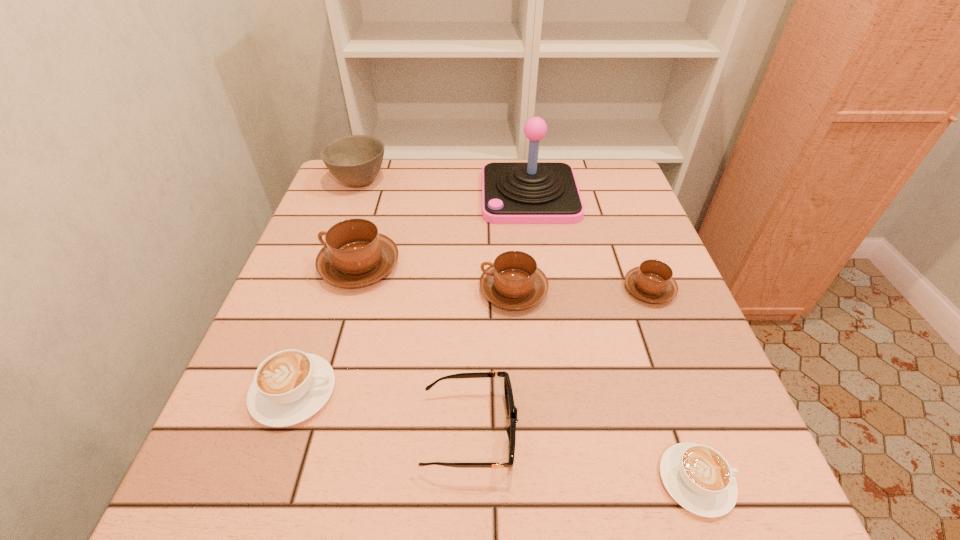
Locate an element on the screen. This screenshot has height=540, width=960. free space at the near left corner of the desktop is located at coordinates (208, 508).

The width and height of the screenshot is (960, 540). I want to click on free space that is in between the shortest cappuccino and the rightmost brown cappuccino, so click(x=673, y=385).

The image size is (960, 540). I want to click on free space between the shortest cappuccino and the smallest brown cappuccino, so click(673, 385).

The image size is (960, 540). Find the location of `vacant area that lies between the tallest object and the bowl`. vacant area that lies between the tallest object and the bowl is located at coordinates (444, 188).

Where is `unoccupied area between the bigger white cappuccino and the nearer white cappuccino`? The width and height of the screenshot is (960, 540). unoccupied area between the bigger white cappuccino and the nearer white cappuccino is located at coordinates (495, 436).

This screenshot has width=960, height=540. In order to click on free spot between the black sunglasses and the bowl in this screenshot , I will do `click(415, 306)`.

You are a GUI agent. You are given a task and a screenshot of the screen. Output one action in this format:
    pyautogui.click(x=<x>, y=<y>)
    Task: Click on the free space between the smallest brown cappuccino and the pink joystick
    
    Given the screenshot: What is the action you would take?
    pyautogui.click(x=589, y=242)

This screenshot has width=960, height=540. Identify the location of free area in between the pink joystick and the sunglasses. (499, 313).

At what (x,y) coordinates should I click in order to perform the action: click on free spot between the tallest object and the smallest brown cappuccino. Please return your answer as a coordinate pair (x, y). This screenshot has height=540, width=960. Looking at the image, I should click on (589, 242).

Where is `empty space between the nearest cappuccino and the bowl`? empty space between the nearest cappuccino and the bowl is located at coordinates (528, 331).